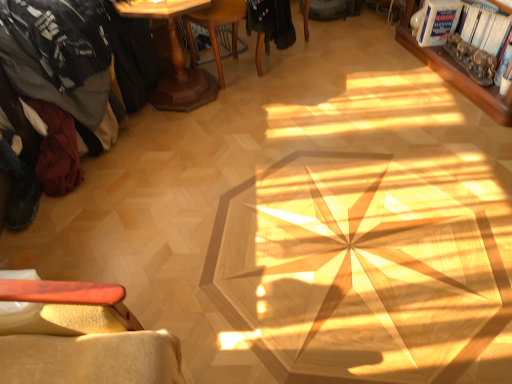
Where is `empty space that is to the right of wooden pedestal table at upper left`? The height and width of the screenshot is (384, 512). empty space that is to the right of wooden pedestal table at upper left is located at coordinates [270, 101].